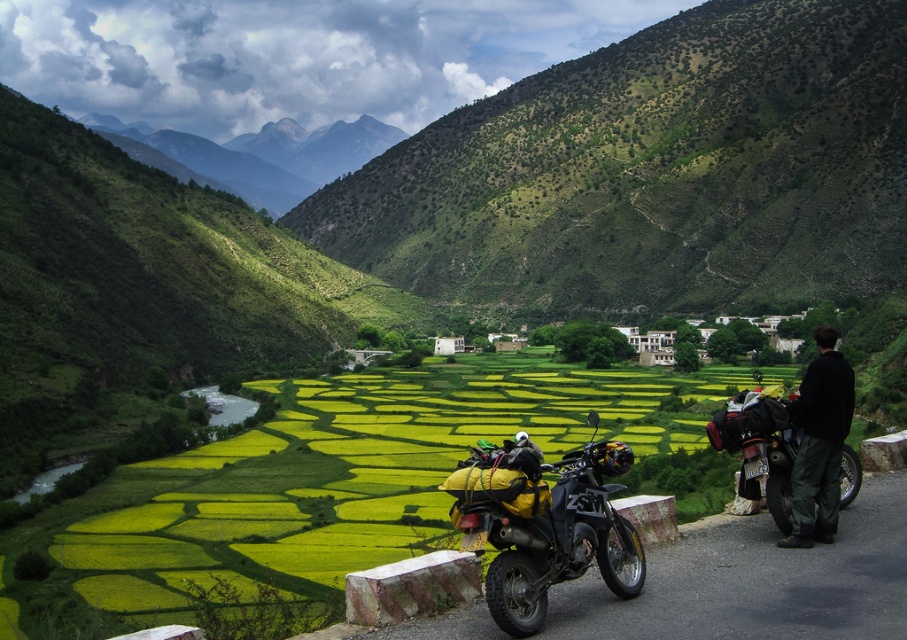
Question: Among these points, which one is nearest to the camera?

Choices:
 (A) (167, 556)
 (B) (797, 513)

Answer: (B)

Question: Which point is farther from the camera taking this photo?

Choices:
 (A) (472, 166)
 (B) (479, 472)

Answer: (A)

Question: Is green grassy hillside at center smaller than black textured motorcycle at right?

Choices:
 (A) no
 (B) yes

Answer: (A)

Question: Among these objects, which one is farthest from the camera?

Choices:
 (A) green textured rice field at center
 (B) black softshell jacket at right
 (C) matte black motorcycle at center
 (D) green grassy hillside at center

Answer: (D)

Question: Is green textured rice field at center wider than black softshell jacket at right?

Choices:
 (A) no
 (B) yes

Answer: (B)

Question: Can you confirm if green grassy hillside at center is smaller than black softshell jacket at right?

Choices:
 (A) yes
 (B) no

Answer: (B)